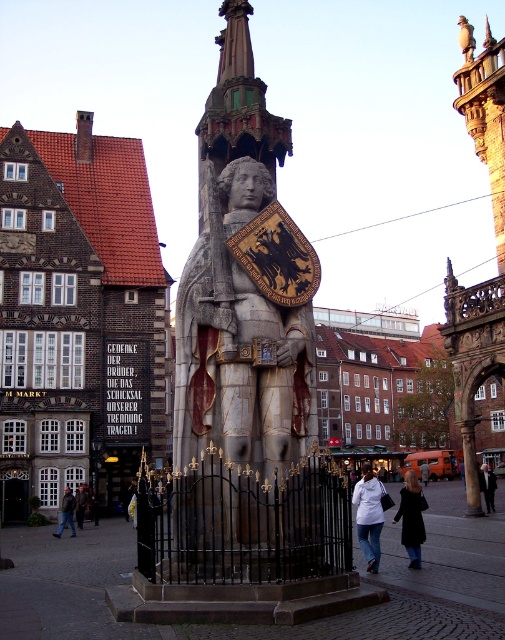
Between point (414, 486) and point (66, 509), which one is positioned behind?

The point (66, 509) is behind.

Is point (413, 566) positioned before point (70, 515)?

That is True.

The image size is (505, 640). What are the coordinates of `black leather coat at lower right` in the screenshot? It's located at (412, 518).

Can you confirm if polished stone statue at center is wider than white fabric coat at center?

No.

Image resolution: width=505 pixels, height=640 pixels. What do you see at coordinates (239, 376) in the screenshot? I see `polished stone statue at center` at bounding box center [239, 376].

Does point (221, 65) come in front of point (370, 490)?

No, (221, 65) is behind (370, 490).

The width and height of the screenshot is (505, 640). I want to click on polished stone statue at center, so click(x=239, y=376).

Can you confirm if black leather coat at lower right is taller than dark brown leather jacket at lower left?

Yes.

Is point (406, 481) behind point (82, 500)?

No.

Identify the location of black leather coat at lower right. (412, 518).